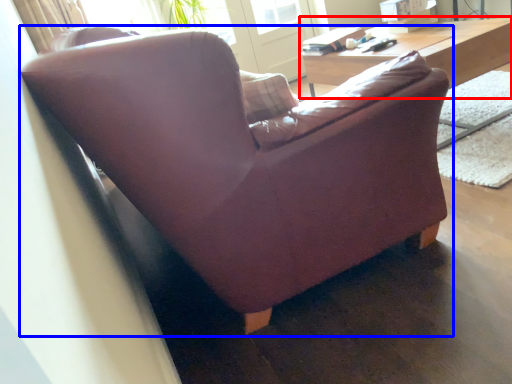
Question: Which object is further to the camera taking this photo, table (highlighted by a red box) or studio couch (highlighted by a blue box)?

Choices:
 (A) table
 (B) studio couch

Answer: (A)